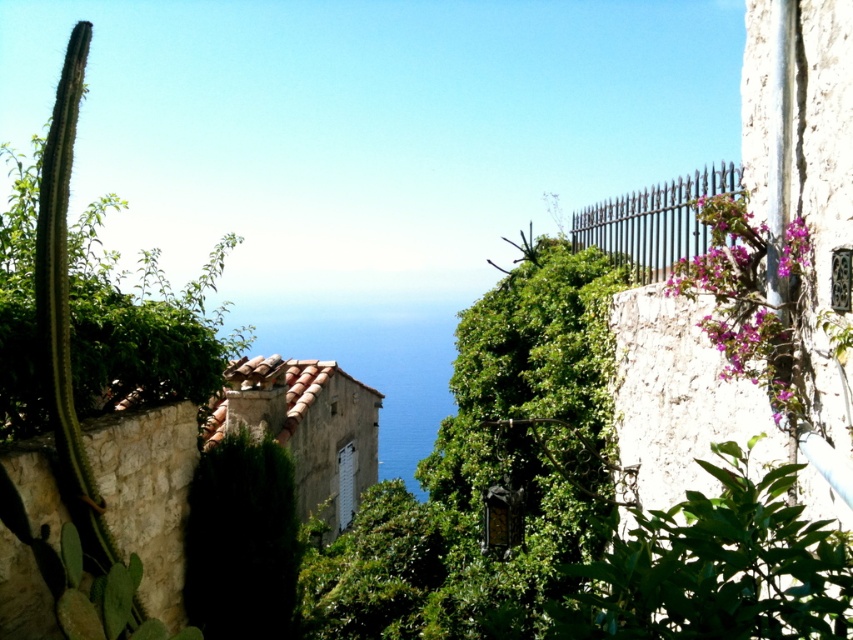
You are a photographer standing at the camera position. You want to take a closeup photo of the pink matte flowers at upper right. Can you walk closer to the flowers to get a better shot without moving the camera? Explain your reasoning.

The pink matte flowers at upper right are 10.67 feet away from the camera. Since you cannot move the camera, you cannot physically walk closer to the flowers to take a better closeup shot. You would need to use a zoom lens instead.

You are a gardener looking at the Mediterranean scene. You see pink matte flowers at upper right and purple matte flowers at upper right. Which of these flowers is positioned lower in the image?

The pink matte flowers at upper right is located below purple matte flowers at upper right, so the pink matte flowers at upper right are positioned lower in the image.